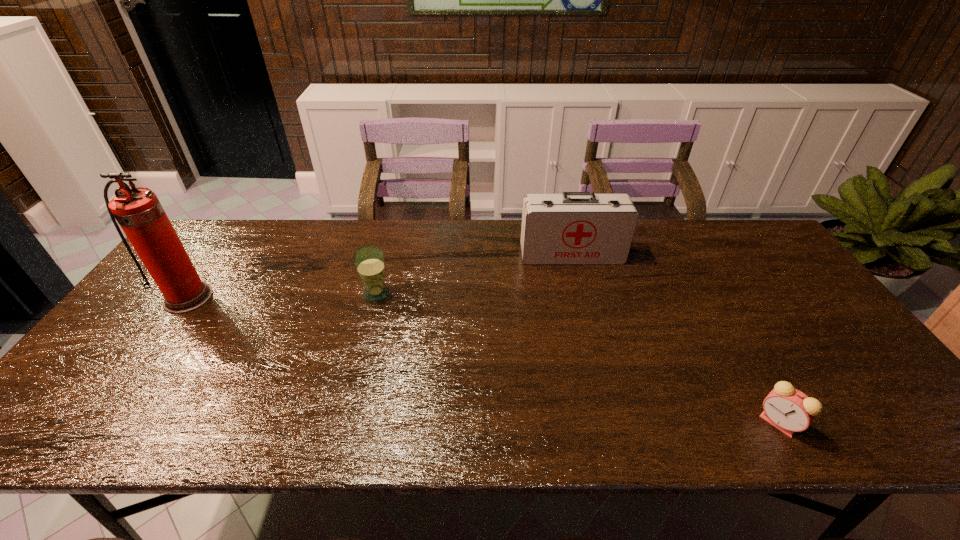
Find the location of a particular element. vacant region located on the left of the second object from left to right is located at coordinates (344, 294).

Locate an element on the screen. The image size is (960, 540). free space located 0.180m on the face of the nearest object is located at coordinates (676, 422).

Find the location of `vacant region located 0.300m on the face of the nearest object`. vacant region located 0.300m on the face of the nearest object is located at coordinates (621, 422).

Locate an element on the screen. vacant space situated 0.290m on the face of the nearest object is located at coordinates (625, 422).

What are the coordinates of `object located at the far edge` in the screenshot? It's located at (574, 228).

Image resolution: width=960 pixels, height=540 pixels. In order to click on object positioned at the near edge in this screenshot , I will do `click(789, 410)`.

Where is `object present at the left edge`? Image resolution: width=960 pixels, height=540 pixels. object present at the left edge is located at coordinates (138, 211).

In the image, there is a desktop. Where is `vacant space at the far edge`? This screenshot has height=540, width=960. vacant space at the far edge is located at coordinates (429, 221).

This screenshot has width=960, height=540. Identify the location of free location at the near edge of the desktop. (192, 420).

Where is `free point at the left edge`? Image resolution: width=960 pixels, height=540 pixels. free point at the left edge is located at coordinates (173, 319).